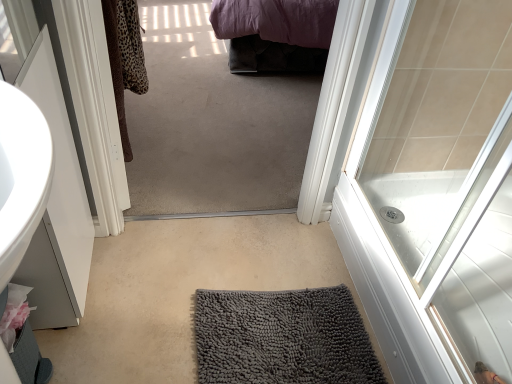
Question: Is gray chenille bath mat at center wider or thinner than gray textured bath mat at center?

Choices:
 (A) wide
 (B) thin

Answer: (B)

Question: Relative to gray textured bath mat at center, is gray chenille bath mat at center in front or behind?

Choices:
 (A) behind
 (B) front

Answer: (A)

Question: Estimate the real-world distances between objects in this image. Which object is farther from the gray chenille bath mat at center?

Choices:
 (A) gray textured bath mat at center
 (B) white glossy door at upper right

Answer: (B)

Question: Which is nearer to the gray textured bath mat at center?

Choices:
 (A) gray chenille bath mat at center
 (B) white glossy door at upper right

Answer: (A)